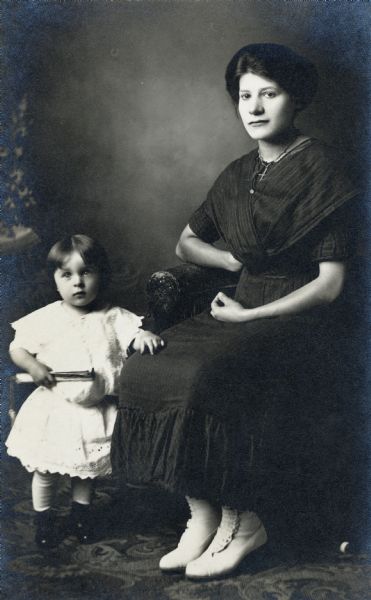
Where is `item on the floor`? The image size is (371, 600). item on the floor is located at coordinates (341, 545).